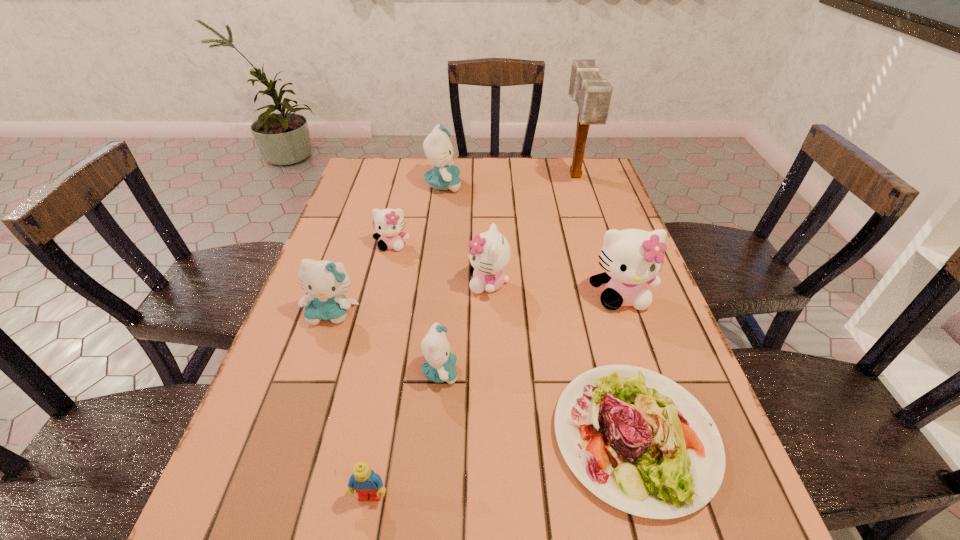
Choose which object is the fourth nearest neighbor to the rightmost white kitten. Please provide its 2D coordinates. Your answer should be formatted as a tuple, i.e. [(x, y)], where the tuple contains the x and y coordinates of a point satisfying the conditions above.

[(592, 94)]

Identify the location of the closest object to the sixth object from left to right. This screenshot has width=960, height=540. (439, 367).

You are a GUI agent. You are given a task and a screenshot of the screen. Output one action in this format:
    pyautogui.click(x=<x>, y=<y>)
    Task: Click on the kitten that is the closest one to the smallest white kitten
    
    Given the screenshot: What is the action you would take?
    pyautogui.click(x=490, y=254)

I want to click on kitten object that ranks as the closest to the wood mallet, so click(437, 146).

Find the location of a particular element. Image resolution: width=960 pixels, height=540 pixels. blue kitten object that ranks as the second closest to the mallet is located at coordinates (439, 367).

Identify which blue kitten is located as the nearest to the biggest blue kitten. Please provide its 2D coordinates. Your answer should be formatted as a tuple, i.e. [(x, y)], where the tuple contains the x and y coordinates of a point satisfying the conditions above.

[(326, 282)]

At what (x,y) coordinates should I click in order to perform the action: click on white kitten that can be found as the second closest to the smallest white kitten. Please return your answer as a coordinate pair (x, y). The width and height of the screenshot is (960, 540). Looking at the image, I should click on click(x=631, y=258).

Locate which white kitten ranks second in proximity to the fourth object from right to left. Please provide its 2D coordinates. Your answer should be formatted as a tuple, i.e. [(x, y)], where the tuple contains the x and y coordinates of a point satisfying the conditions above.

[(631, 258)]

Identify the location of free spot that satisfies the following two spatial constraints: 1. on the face of the green salad plate; 2. on the left side of the second biggest blue kitten. (290, 436).

This screenshot has height=540, width=960. Identify the location of free space that satisfies the following two spatial constraints: 1. on the face of the smallest blue kitten; 2. on the face of the blue Lego. (430, 496).